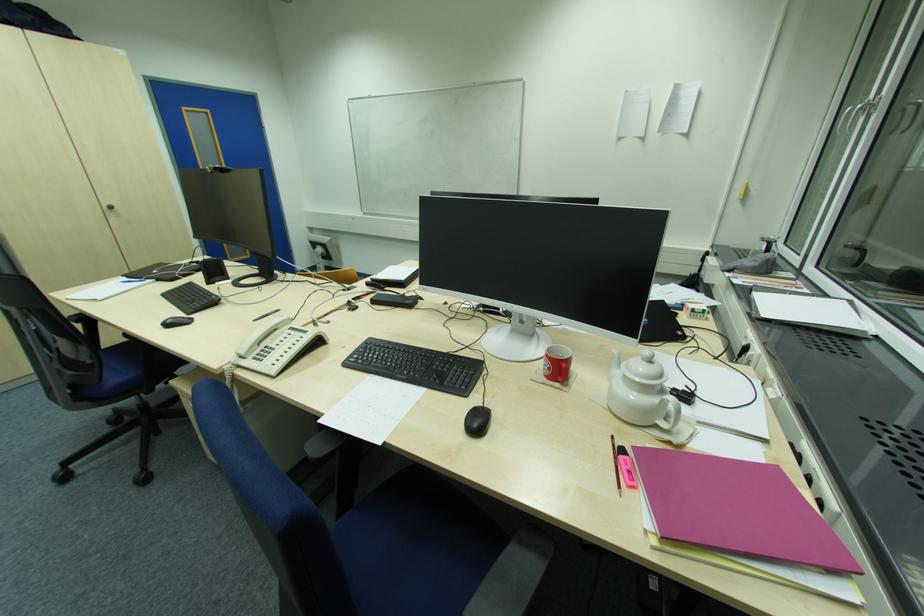
Locate an element on the screen. teapot lid handle is located at coordinates (663, 424).